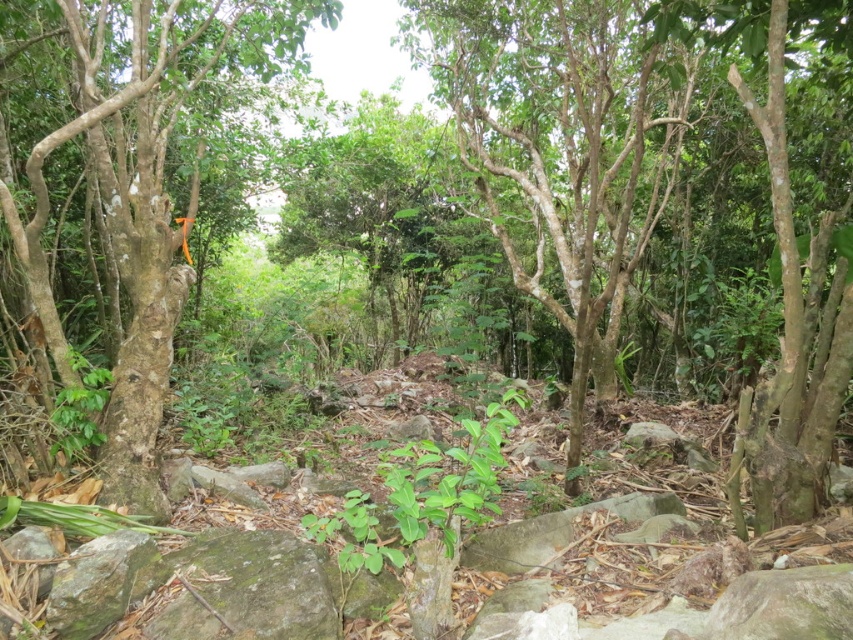
You are a hiker with a 10 meter long rope. You want to tie the orange ribbon to a tree that is exactly 10 meters away from you. Can you use your rope to reach the smooth bark tree at center?

The smooth bark tree at center is 11.35 meters away from you, so your 10 meter rope is not long enough to reach it. You need a longer rope.

You are a hiker navigating through this forest and want to reach the smooth bark tree at center. Which direction should you move relative to the green rough bark tree at left to get there?

You should move towards the direction of the smooth bark tree at center because it is closer to you than the green rough bark tree at left.